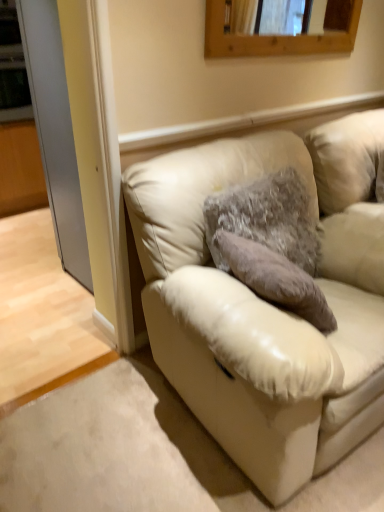
You are a GUI agent. You are given a task and a screenshot of the screen. Output one action in this format:
    pyautogui.click(x=<x>, y=<y>)
    Task: Click on the vacant space to the left of clear glass door at left
    Image resolution: width=384 pixels, height=512 pixels.
    Given the screenshot: What is the action you would take?
    pyautogui.click(x=37, y=274)